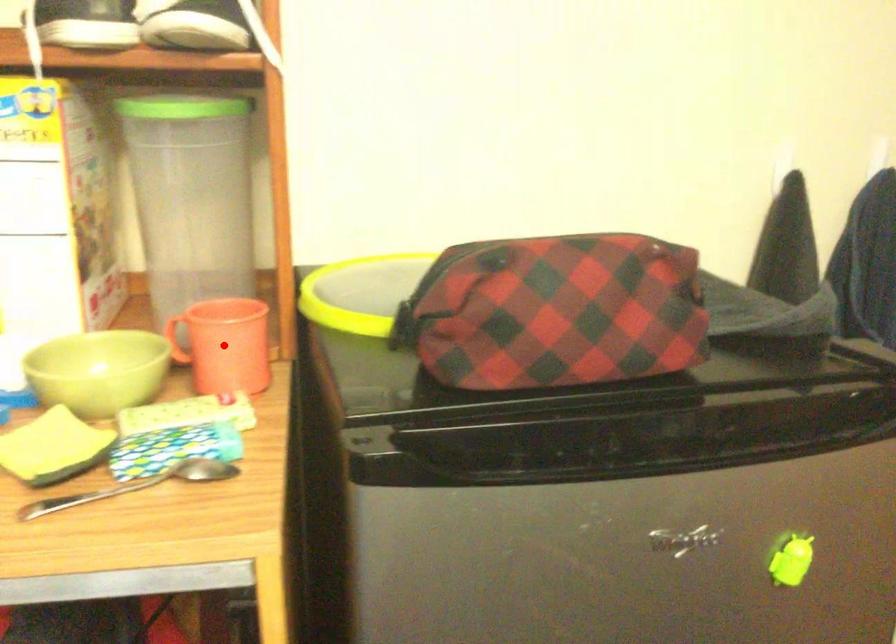
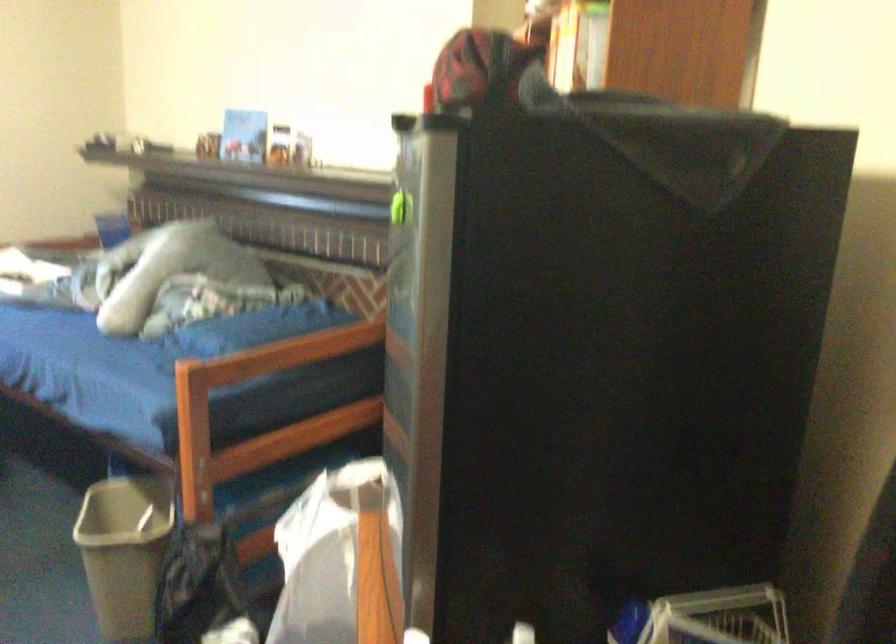
Question: I am providing you with two images of the same scene from different viewpoints. A red point is marked on the first image. At the location where the point appears in image 1, is it still visible in image 2?

Choices:
 (A) Yes
 (B) No

Answer: (B)